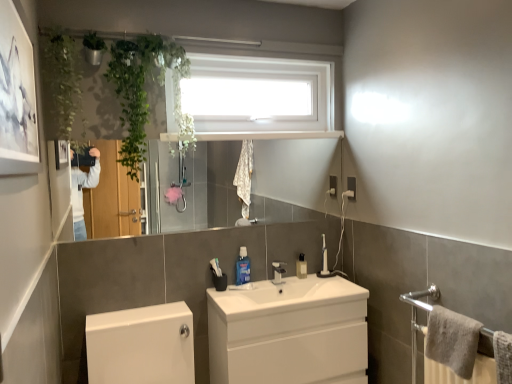
Find the location of `vacant space to the left of translucent plastic bottle at center, which is the 1th toiletry in right-to-left order`. vacant space to the left of translucent plastic bottle at center, which is the 1th toiletry in right-to-left order is located at coordinates (284, 277).